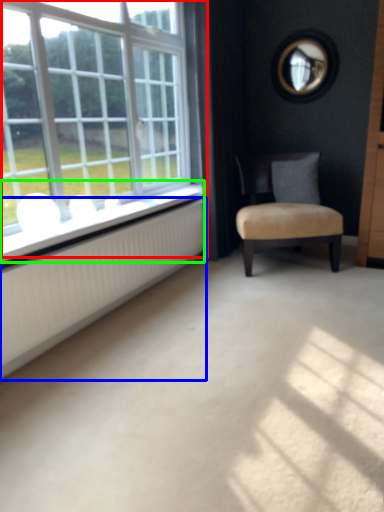
Question: Which object is the farthest from window (highlighted by a red box)? Choose among these: radiator (highlighted by a blue box) or window sill (highlighted by a green box).

Choices:
 (A) radiator
 (B) window sill

Answer: (A)